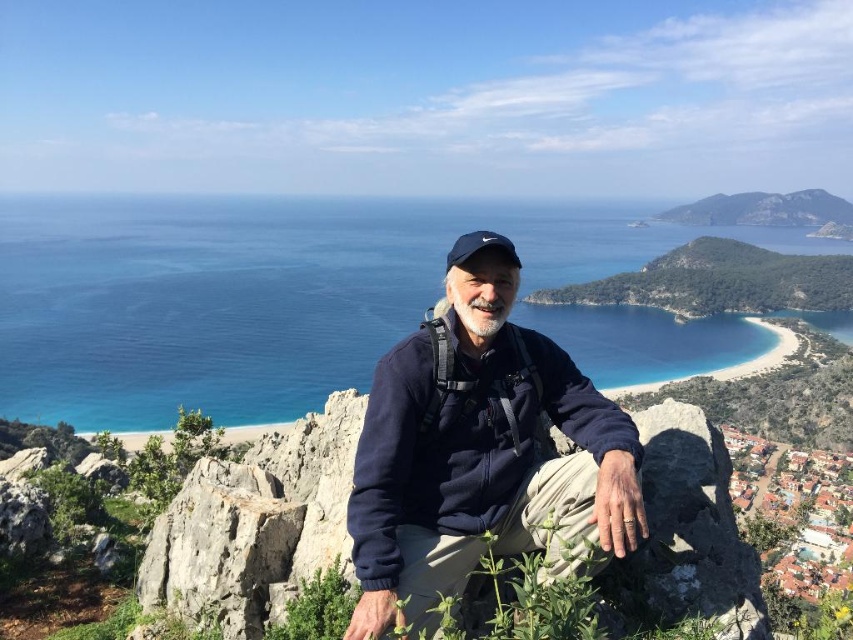
You are a photographer standing at the camera position. You want to capture a closeup shot of the rugged stone cliff at center. Given that your telephoto lens can focus on objects within 30 meters, will you be able to take the photo without moving closer?

The rugged stone cliff at center is 27.83 meters from camera, which is within the 30 meters focus range of the telephoto lens. Therefore, you can take the closeup shot without moving closer.

You are standing at the viewpoint and want to reach the point marked as point (x=457, y=480). If your walking speed is 1.5 meters per second, how many seconds will it take you to reach that point?

The point (x=457, y=480) is 30.66 meters away from the viewer. At a walking speed of 1.5 meters per second, it will take approximately 20.44 seconds to reach the point.

You are a hiker who has just reached a scenic viewpoint. You see the navy blue fleece at center. Where exactly is the navy blue fleece located in terms of coordinates?

The navy blue fleece at center is located at coordinates point (479, 449).